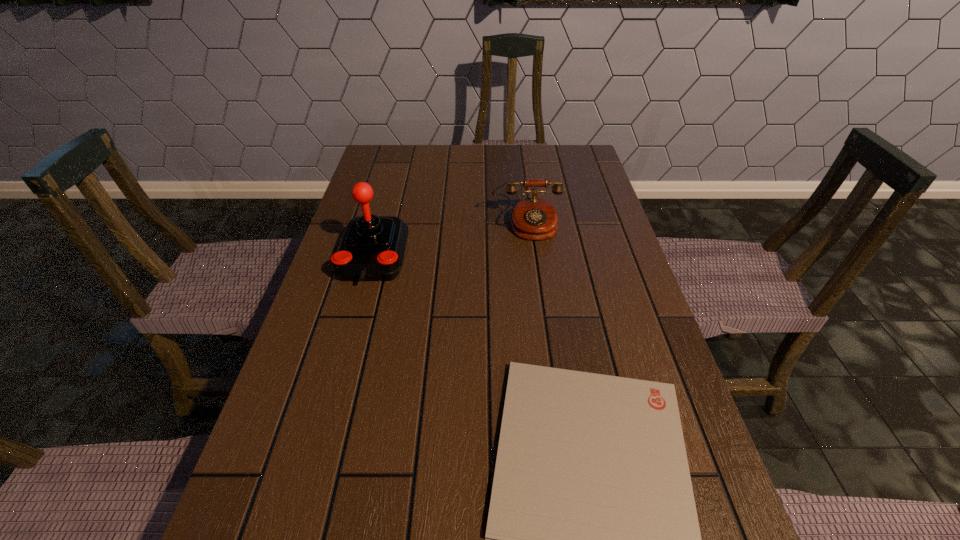
Identify the location of the leftmost object. This screenshot has width=960, height=540. (372, 248).

Locate an element on the screen. This screenshot has width=960, height=540. joystick is located at coordinates (372, 248).

At what (x,y) coordinates should I click in order to perform the action: click on the second shortest object. Please return your answer as a coordinate pair (x, y). The width and height of the screenshot is (960, 540). Looking at the image, I should click on (533, 218).

At what (x,y) coordinates should I click in order to perform the action: click on free space located on the base of the joystick. Please return your answer as a coordinate pair (x, y). This screenshot has width=960, height=540. Looking at the image, I should click on (349, 343).

Find the location of `free region located 0.380m on the dial of the second tallest object`. free region located 0.380m on the dial of the second tallest object is located at coordinates (543, 354).

Identify the location of object located at the left edge. (372, 248).

Find the location of `object at the right edge`. object at the right edge is located at coordinates (533, 218).

This screenshot has height=540, width=960. In the image, there is a desktop. Identify the location of vacant space at the far edge. (464, 160).

Image resolution: width=960 pixels, height=540 pixels. I want to click on vacant space at the left edge of the desktop, so click(x=360, y=375).

This screenshot has width=960, height=540. In order to click on vacant region at the right edge of the desktop in this screenshot , I will do `click(579, 186)`.